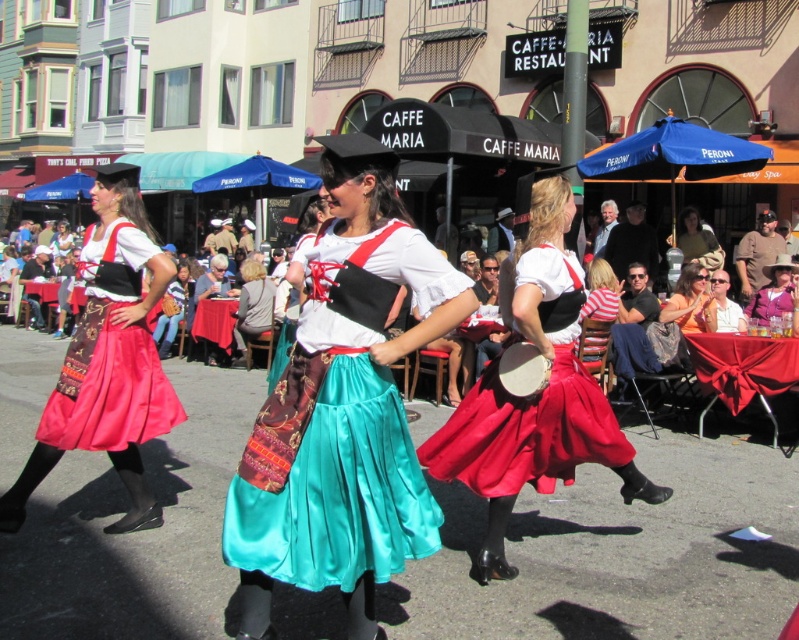
You are a photographer trying to capture the vibrant orange fabric dress at center and the matte brown leather purse at center in a single frame. Since you want the dress to be the main focus, which object should you ensure is closer to the camera to maintain its prominence?

The orange fabric dress at center has a smaller size compared to matte brown leather purse at center. To ensure the dress remains the main focus, you should position it closer to the camera since smaller objects need to be nearer to appear prominent in the frame.

You are a photographer trying to capture the orange fabric dress at center and the matte brown leather purse at center in a single shot. Based on their sizes, which object should you focus on to ensure both are clearly visible in the photo?

The orange fabric dress at center is not as tall as matte brown leather purse at center, so you should focus on the matte brown leather purse at center since it is taller and will be easier to capture clearly in the photo.

You are a tailor measuring garments for alterations. You have a brown leather hat at upper right and a brown leather jacket at center. Which item has a larger width?

The brown leather hat at upper right has a larger width than the brown leather jacket at center because the brown leather hat at upper right surpasses the brown leather jacket at center in width.